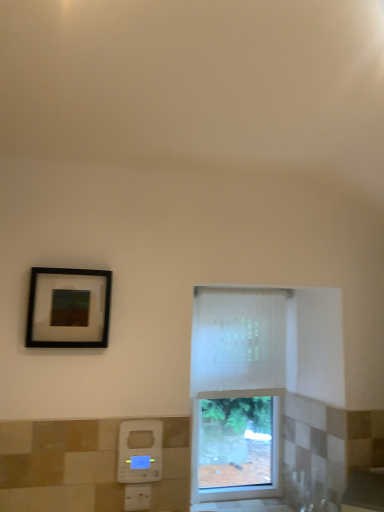
Question: Are matte black picture frame at upper left and white plastic hand dryer at lower center making contact?

Choices:
 (A) no
 (B) yes

Answer: (A)

Question: Considering the relative sizes of matte black picture frame at upper left and white plastic hand dryer at lower center in the image provided, is matte black picture frame at upper left taller than white plastic hand dryer at lower center?

Choices:
 (A) yes
 (B) no

Answer: (A)

Question: Is matte black picture frame at upper left far from white plastic hand dryer at lower center?

Choices:
 (A) yes
 (B) no

Answer: (B)

Question: Is matte black picture frame at upper left not inside white plastic hand dryer at lower center?

Choices:
 (A) no
 (B) yes

Answer: (B)

Question: Can you confirm if matte black picture frame at upper left is bigger than white plastic hand dryer at lower center?

Choices:
 (A) yes
 (B) no

Answer: (A)

Question: From their relative heights in the image, would you say white sheer curtain at center is taller or shorter than white plastic hand dryer at lower center?

Choices:
 (A) tall
 (B) short

Answer: (A)

Question: Considering their positions, is white sheer curtain at center located in front of or behind white plastic hand dryer at lower center?

Choices:
 (A) behind
 (B) front

Answer: (A)

Question: In the image, is white sheer curtain at center on the left side or the right side of white plastic hand dryer at lower center?

Choices:
 (A) right
 (B) left

Answer: (A)

Question: Considering the positions of white sheer curtain at center and white plastic hand dryer at lower center in the image, is white sheer curtain at center bigger or smaller than white plastic hand dryer at lower center?

Choices:
 (A) small
 (B) big

Answer: (B)

Question: Considering the positions of white textured window at center and white sheer curtain at center in the image, is white textured window at center taller or shorter than white sheer curtain at center?

Choices:
 (A) tall
 (B) short

Answer: (A)

Question: From the image's perspective, is white textured window at center above or below white sheer curtain at center?

Choices:
 (A) below
 (B) above

Answer: (A)

Question: Is white textured window at center spatially inside white sheer curtain at center, or outside of it?

Choices:
 (A) outside
 (B) inside

Answer: (B)

Question: In terms of size, does white textured window at center appear bigger or smaller than white sheer curtain at center?

Choices:
 (A) small
 (B) big

Answer: (B)

Question: Is white sheer curtain at center in front of or behind matte black picture frame at upper left in the image?

Choices:
 (A) behind
 (B) front

Answer: (A)

Question: In terms of size, does white sheer curtain at center appear bigger or smaller than matte black picture frame at upper left?

Choices:
 (A) big
 (B) small

Answer: (A)